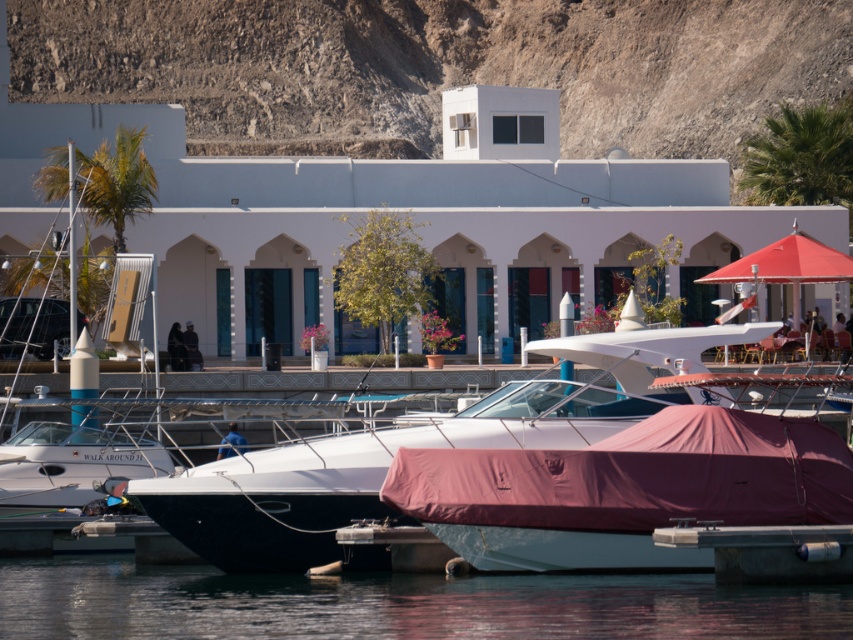
Consider the image. Measure the distance between point (142, 502) and camera.

The distance of point (142, 502) from camera is 158.45 feet.

Who is higher up, white matte boat at center or white glossy boat at left?

white glossy boat at left

What do you see at coordinates (415, 445) in the screenshot?
I see `white matte boat at center` at bounding box center [415, 445].

Locate an element on the screen. This screenshot has width=853, height=640. white matte boat at center is located at coordinates (415, 445).

Who is more forward, (595, 122) or (329, 616)?

Point (329, 616) is in front.

Describe the element at coordinates (436, 67) in the screenshot. I see `dull gray rock at upper center` at that location.

Is point (346, 65) closer to camera compared to point (827, 628)?

No, it is not.

Identify the location of dull gray rock at upper center. pyautogui.click(x=436, y=67).

Who is taller, dull gray rock at upper center or white glossy boat at left?

Standing taller between the two is dull gray rock at upper center.

Can you confirm if dull gray rock at upper center is thinner than white glossy boat at left?

No.

At what (x,y) coordinates should I click in order to perform the action: click on dull gray rock at upper center. Please return your answer as a coordinate pair (x, y). This screenshot has height=640, width=853. Looking at the image, I should click on (436, 67).